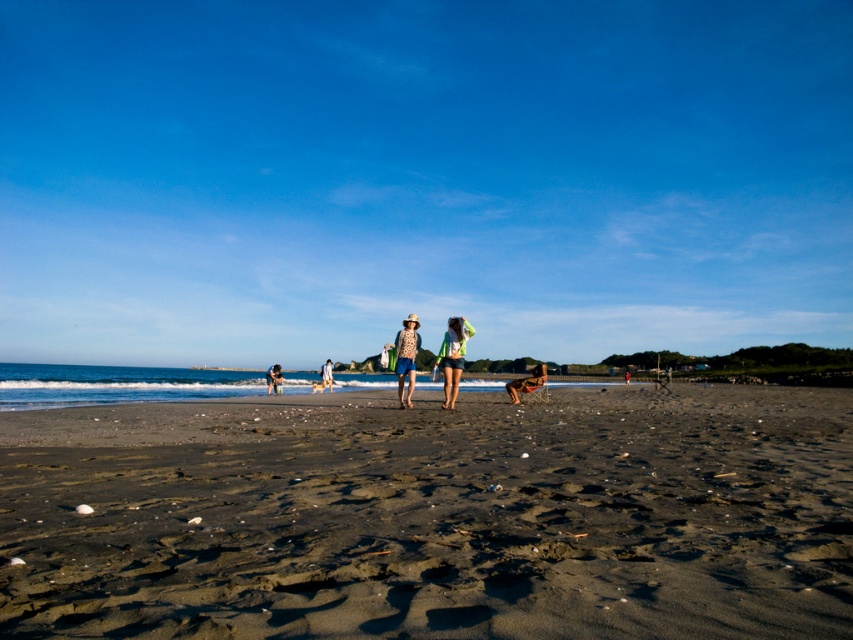
You are standing on the beach and want to place a 2.5 meter long wooden board between the dark brown sand at center and the green fabric bag at center. Can you fit the board horizontally between them without bending it?

The distance between the dark brown sand at center and the green fabric bag at center is 52.30 meters. Since the board is only 2.5 meters long, it will not reach between them. You need a longer board to span the distance.

You are a photographer trying to capture a closeup of the dark brown sand at center and the patterned fabric shirt at center. Which object should you zoom in on to ensure both are in focus without moving the camera?

The dark brown sand at center is larger in size than the patterned fabric shirt at center, so you should zoom in on the dark brown sand at center to ensure both are in focus without moving the camera.